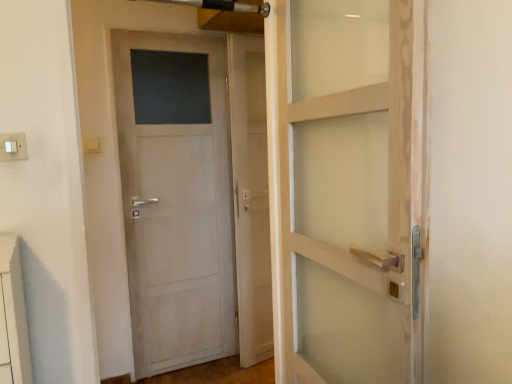
Question: Would you say transparent glass screen door at center is outside white plastic switch at upper left?

Choices:
 (A) no
 (B) yes

Answer: (B)

Question: From a real-world perspective, is transparent glass screen door at center located higher than white plastic switch at upper left?

Choices:
 (A) yes
 (B) no

Answer: (B)

Question: Is transparent glass screen door at center behind white plastic switch at upper left?

Choices:
 (A) no
 (B) yes

Answer: (B)

Question: Does transparent glass screen door at center have a lesser height compared to white plastic switch at upper left?

Choices:
 (A) no
 (B) yes

Answer: (A)

Question: Is transparent glass screen door at center at the left side of white plastic switch at upper left?

Choices:
 (A) yes
 (B) no

Answer: (B)

Question: Considering their positions, is transparent glass screen door at center located in front of or behind white plastic switch at upper left?

Choices:
 (A) behind
 (B) front

Answer: (A)

Question: From the image's perspective, is transparent glass screen door at center located above or below white plastic switch at upper left?

Choices:
 (A) above
 (B) below

Answer: (B)

Question: From a real-world perspective, is transparent glass screen door at center physically located above or below white plastic switch at upper left?

Choices:
 (A) above
 (B) below

Answer: (B)

Question: Would you say transparent glass screen door at center is to the left or to the right of white plastic switch at upper left in the picture?

Choices:
 (A) left
 (B) right

Answer: (B)

Question: From a real-world perspective, is white wood door at left physically located above or below white plastic switch at upper left?

Choices:
 (A) below
 (B) above

Answer: (A)

Question: Considering the positions of white wood door at left and white plastic switch at upper left in the image, is white wood door at left wider or thinner than white plastic switch at upper left?

Choices:
 (A) wide
 (B) thin

Answer: (A)

Question: In terms of height, does white wood door at left look taller or shorter compared to white plastic switch at upper left?

Choices:
 (A) tall
 (B) short

Answer: (A)

Question: Do you think white wood door at left is within white plastic switch at upper left, or outside of it?

Choices:
 (A) outside
 (B) inside

Answer: (A)

Question: From the image's perspective, relative to white wood door at left, is white plastic switch at upper left above or below?

Choices:
 (A) below
 (B) above

Answer: (B)

Question: From a real-world perspective, relative to white wood door at left, is white plastic switch at upper left vertically above or below?

Choices:
 (A) below
 (B) above

Answer: (B)